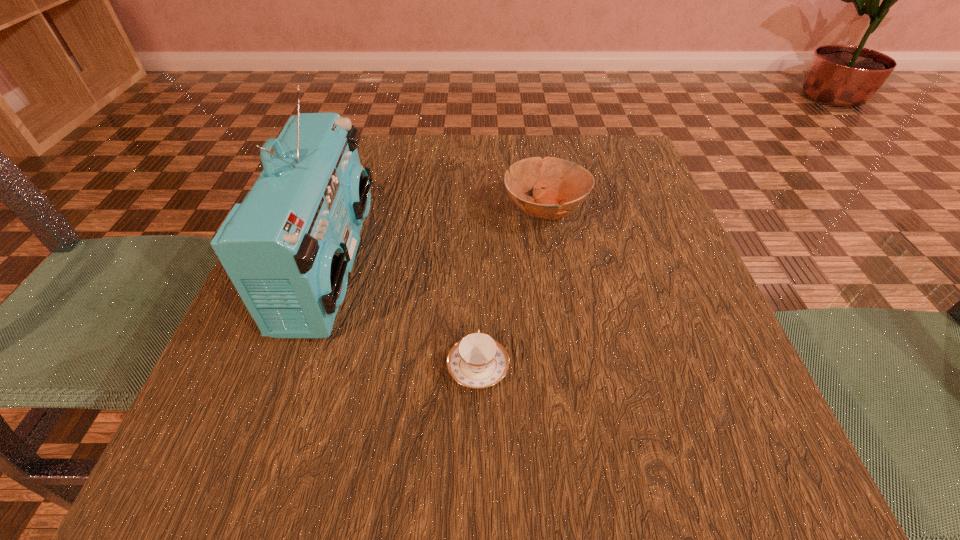
Where is `vacant space positioned on the side with the handle of the second object from left to right`? This screenshot has height=540, width=960. vacant space positioned on the side with the handle of the second object from left to right is located at coordinates (478, 259).

Where is `object that is at the far edge`? This screenshot has height=540, width=960. object that is at the far edge is located at coordinates (567, 184).

You are a GUI agent. You are given a task and a screenshot of the screen. Output one action in this format:
    pyautogui.click(x=<x>, y=<y>)
    Task: Click on the object that is at the left edge
    This screenshot has height=540, width=960.
    Given the screenshot: What is the action you would take?
    pyautogui.click(x=288, y=247)

Locate an element on the screen. Image resolution: width=960 pixels, height=540 pixels. object that is at the right edge is located at coordinates (567, 184).

I want to click on object at the far right corner, so click(567, 184).

This screenshot has height=540, width=960. Identify the location of vacant space at the far edge of the desktop. (537, 138).

Where is `vacant space at the left edge of the desktop`? vacant space at the left edge of the desktop is located at coordinates (281, 375).

This screenshot has height=540, width=960. In order to click on free space at the right edge in this screenshot , I will do `click(679, 345)`.

You are a GUI agent. You are given a task and a screenshot of the screen. Output one action in this format:
    pyautogui.click(x=<x>, y=<y>)
    Task: Click on the free space at the far left corner
    The image size is (960, 540).
    Given the screenshot: What is the action you would take?
    pyautogui.click(x=385, y=160)

I want to click on vacant space at the near right corner of the desktop, so click(773, 442).